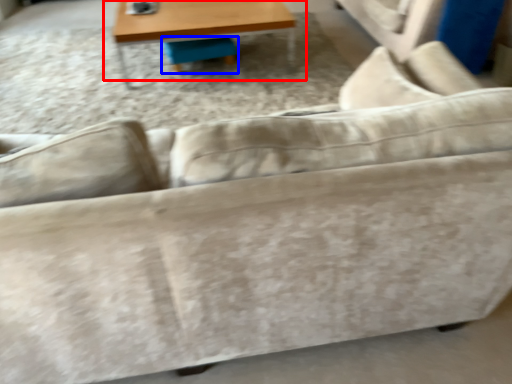
Question: Which object appears farthest to the camera in this image, table (highlighted by a red box) or swivel chair (highlighted by a blue box)?

Choices:
 (A) table
 (B) swivel chair

Answer: (B)